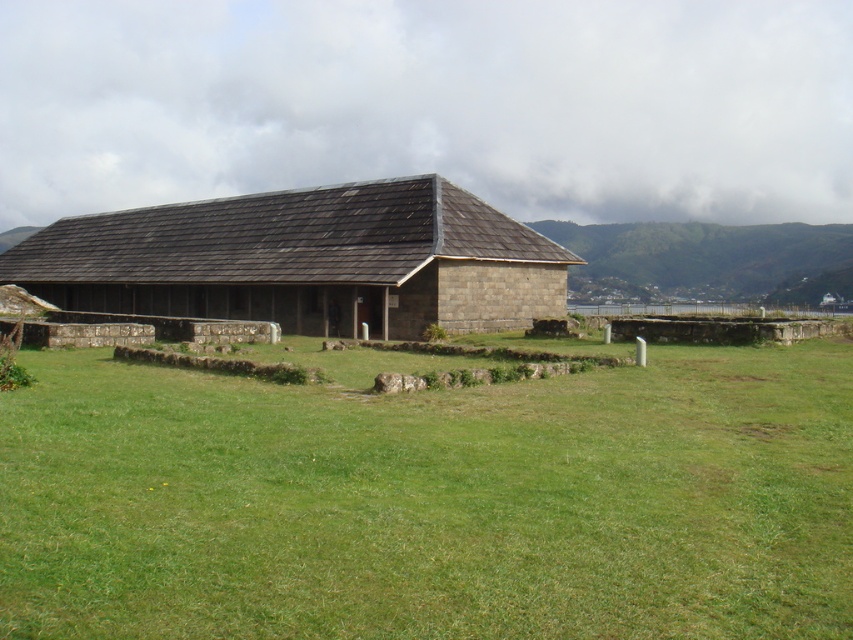
Does green grass at center have a greater width compared to green grassy hillside at upper right?

In fact, green grass at center might be narrower than green grassy hillside at upper right.

Is green grass at center smaller than green grassy hillside at upper right?

Correct, green grass at center occupies less space than green grassy hillside at upper right.

Image resolution: width=853 pixels, height=640 pixels. In order to click on green grass at center in this screenshot , I will do `click(432, 502)`.

Locate an element on the screen. green grass at center is located at coordinates (432, 502).

This screenshot has height=640, width=853. Find the location of `green grass at center`. green grass at center is located at coordinates (432, 502).

Does green grass at center appear over stone shingled hut at center?

Actually, green grass at center is below stone shingled hut at center.

Is point (141, 470) positioned before point (346, 323)?

Yes.

The height and width of the screenshot is (640, 853). In order to click on green grass at center in this screenshot , I will do `click(432, 502)`.

Is stone shingled hut at center positioned at the back of green grassy hillside at upper right?

That is False.

Between stone shingled hut at center and green grassy hillside at upper right, which one is positioned lower?

Positioned lower is stone shingled hut at center.

Measure the distance between stone shingled hut at center and camera.

stone shingled hut at center and camera are 31.89 meters apart from each other.

The width and height of the screenshot is (853, 640). Find the location of `stone shingled hut at center`. stone shingled hut at center is located at coordinates (305, 260).